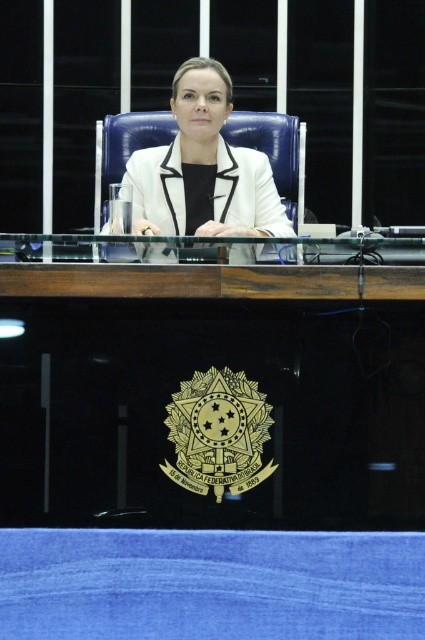
In the scene shown: You are a photographer setting up for an official portrait. You need to position a light source to the left of the transparent glass table at center and to the right of the white glossy blazer at center. Is this possible based on their current arrangement?

The transparent glass table at center is positioned on the right side of the white glossy blazer at center. Therefore, placing the light source to the left of the transparent glass table at center would also place it to the right of the white glossy blazer at center, making this arrangement possible.